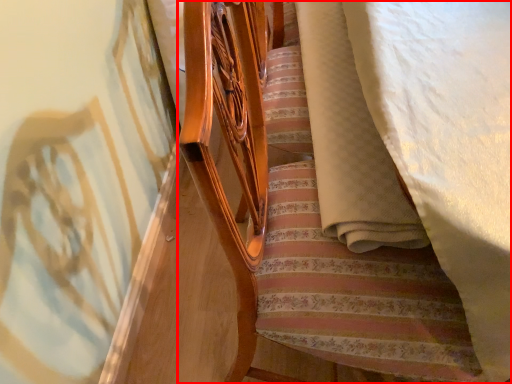
Question: Observing the image, what is the correct spatial positioning of furniture (annotated by the red box) in reference to blanket?

Choices:
 (A) right
 (B) left

Answer: (B)